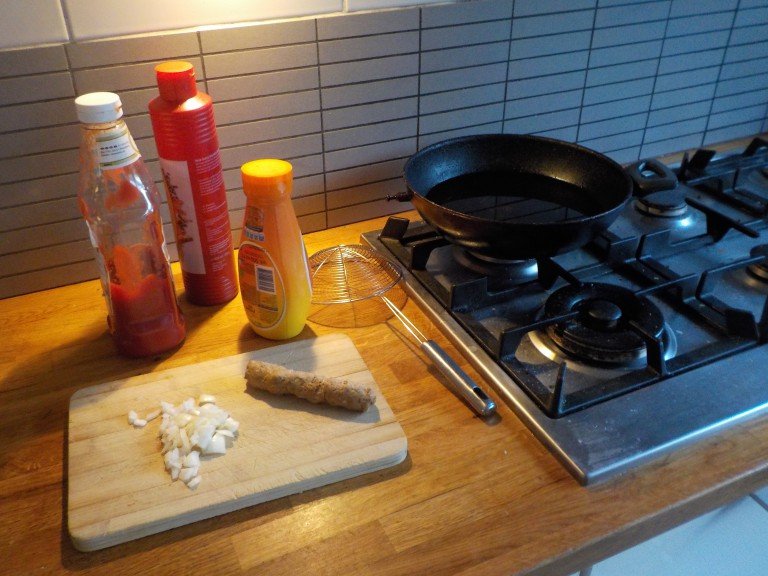
You are a GUI agent. You are given a task and a screenshot of the screen. Output one action in this format:
    pyautogui.click(x=<x>, y=<y>)
    Task: Click on the counter
    
    Given the screenshot: What is the action you would take?
    pyautogui.click(x=488, y=545)